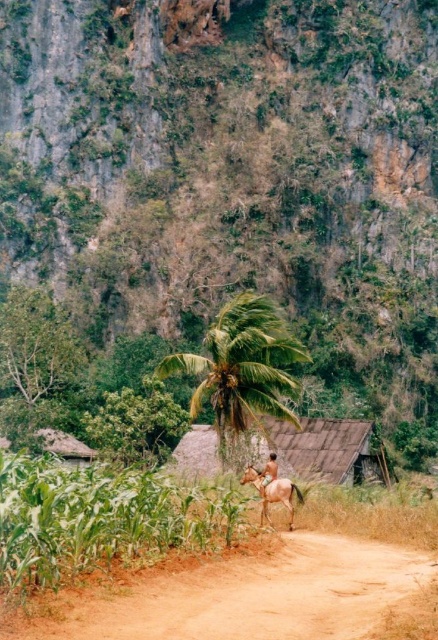
You are a hiker standing at the base of the cliffs and want to reach the green leafy hillside at upper center marked by point (233, 172). Based on the scene description, which direction should you head to from your current position?

The point (233, 172) marks the green leafy hillside at upper center, so you should head towards the upper center direction from your current position at the base of the cliffs.

From the picture: You are a tourist standing in front of the two brown horses in the center of the image. Which horse is closer to you, the brown glossy horse at center or the brown leather horse at center?

The brown glossy horse at center is closer to you because the brown leather horse at center is positioned behind it.

You are a hiker standing at the base of the cliffs and want to reach the brown glossy horse at center. Which direction should you move relative to the green leafy hillside at upper center?

To reach the brown glossy horse at center from the base of the cliffs, you should move downward away from the green leafy hillside at upper center since the hillside is positioned over the horse.